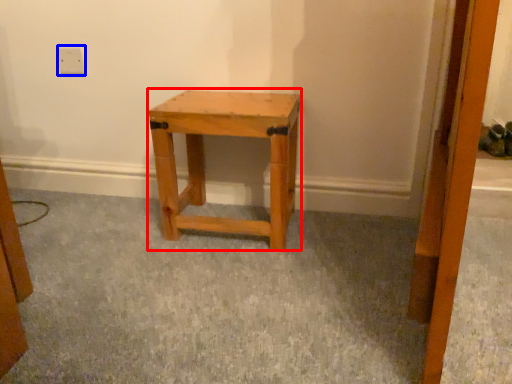
Question: Which of the following is the closest to the observer, stool (highlighted by a red box) or electric outlet (highlighted by a blue box)?

Choices:
 (A) stool
 (B) electric outlet

Answer: (A)